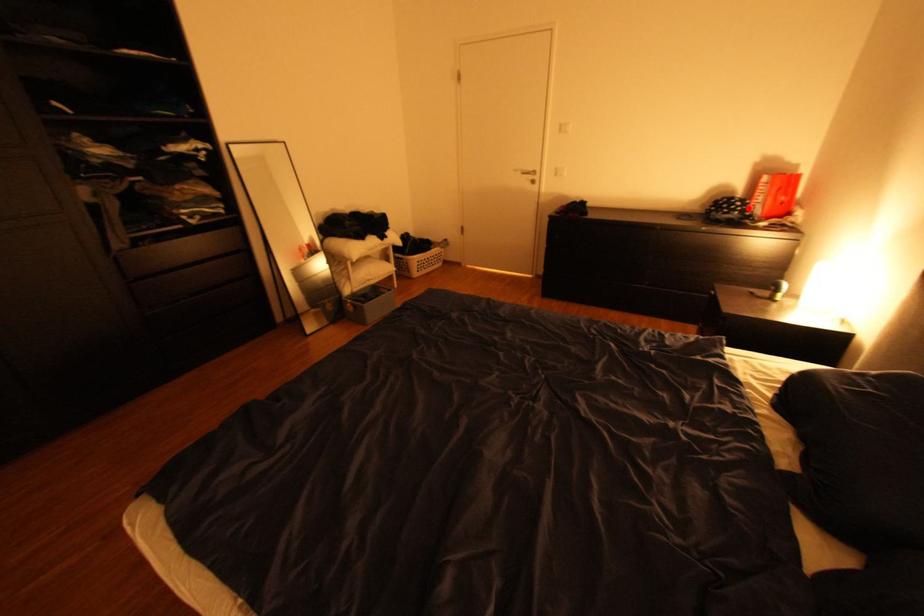
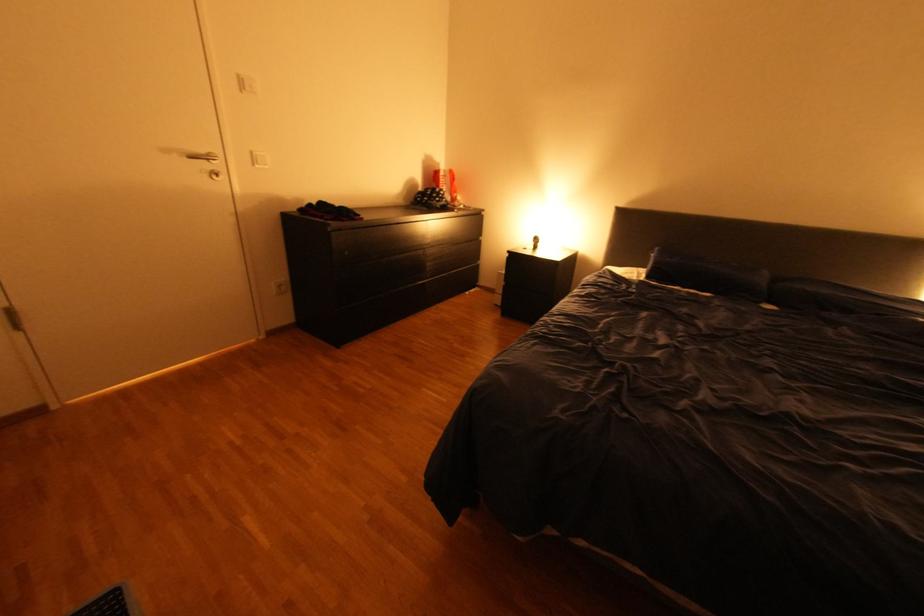
Question: I am providing you with two images of the same scene from different viewpoints. A red point is shown in image1. For the corresponding object point in image2, is it positioned nearer or farther from the camera?

Choices:
 (A) Nearer
 (B) Farther

Answer: (A)